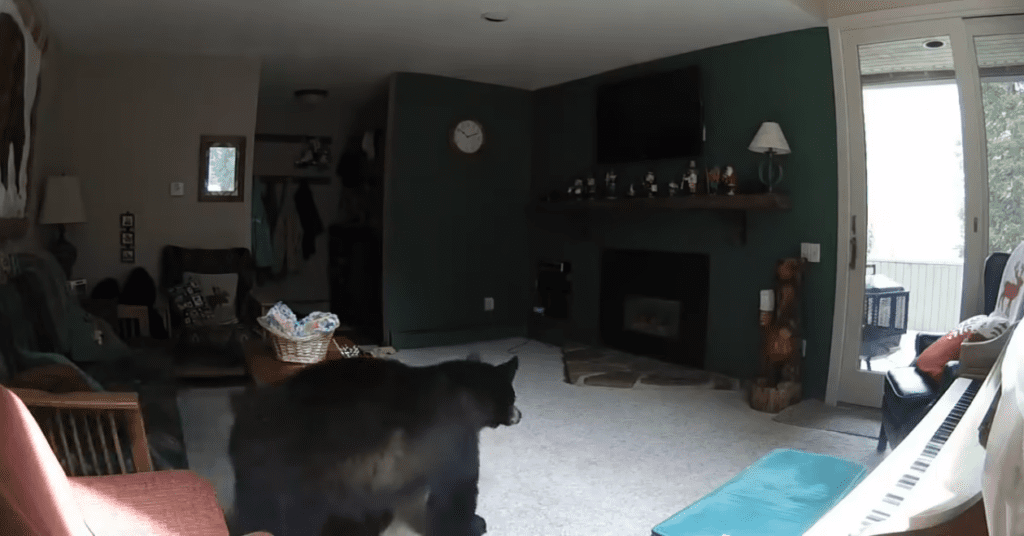
I want to click on dark green wall, so click(x=480, y=204), click(x=768, y=85), click(x=571, y=131).